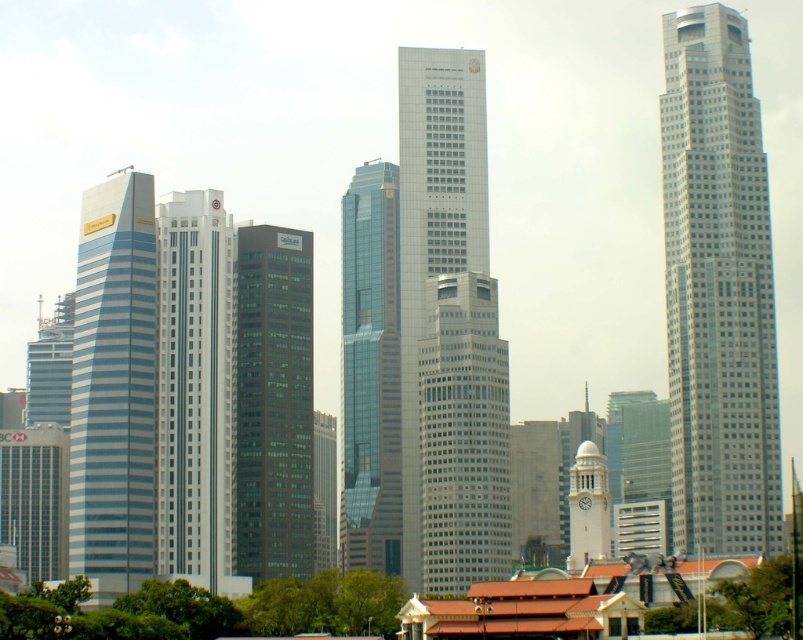
What do you see at coordinates (272, 403) in the screenshot?
I see `green glass building at center` at bounding box center [272, 403].

Between green glass building at center and glassy steel skyscraper at center, which one is positioned higher?

Positioned higher is green glass building at center.

You are a GUI agent. You are given a task and a screenshot of the screen. Output one action in this format:
    pyautogui.click(x=<x>, y=<y>)
    Task: Click on the green glass building at center
    This screenshot has width=803, height=640.
    Given the screenshot: What is the action you would take?
    pyautogui.click(x=272, y=403)

Does gray glass skyscraper at center appear on the right side of white stone clock tower at center?

Incorrect, gray glass skyscraper at center is not on the right side of white stone clock tower at center.

What do you see at coordinates (463, 436) in the screenshot? This screenshot has height=640, width=803. I see `gray glass skyscraper at center` at bounding box center [463, 436].

This screenshot has width=803, height=640. What do you see at coordinates (463, 436) in the screenshot?
I see `gray glass skyscraper at center` at bounding box center [463, 436].

Image resolution: width=803 pixels, height=640 pixels. What are the coordinates of `gray glass skyscraper at center` in the screenshot? It's located at (463, 436).

Is blue glass skyscraper at left thinner than glassy silver skyscraper at center?

No.

Who is positioned more to the left, blue glass skyscraper at left or glassy silver skyscraper at center?

blue glass skyscraper at left

Locate an element on the screen. blue glass skyscraper at left is located at coordinates (113, 388).